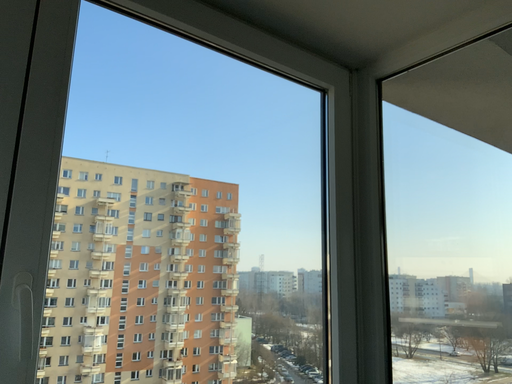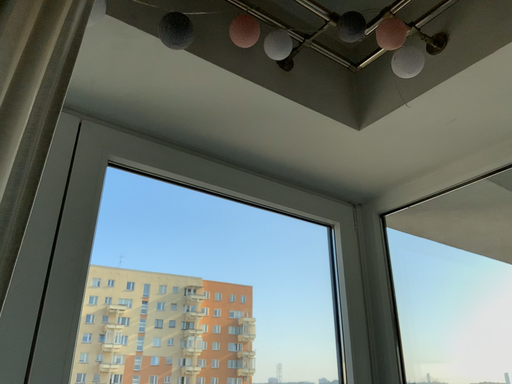
Question: Which way did the camera rotate in the video?

Choices:
 (A) rotated downward
 (B) rotated upward

Answer: (B)